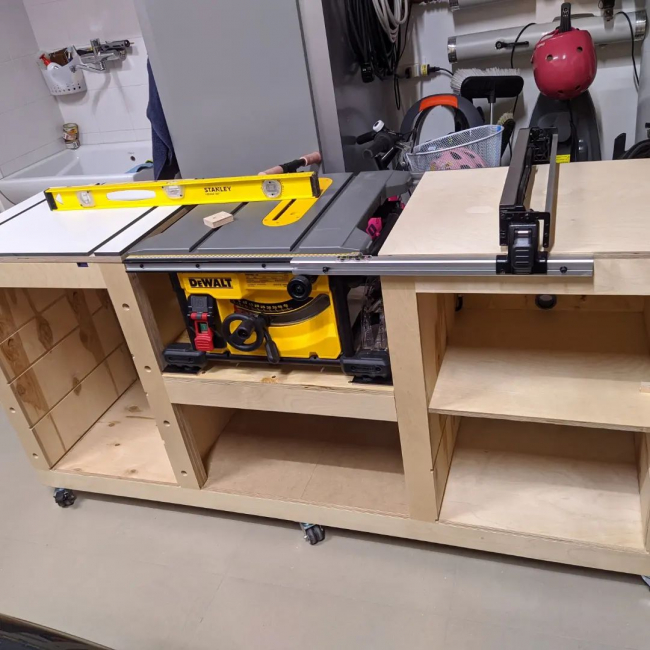
Find the post it notes in the image. Your answer should be formatted as a list of tuples, i.e. [(x1, y1), (x2, y2), ...], where each tuple contains the x and y coordinates of a point satisfying the conditions above.

[(218, 214)]